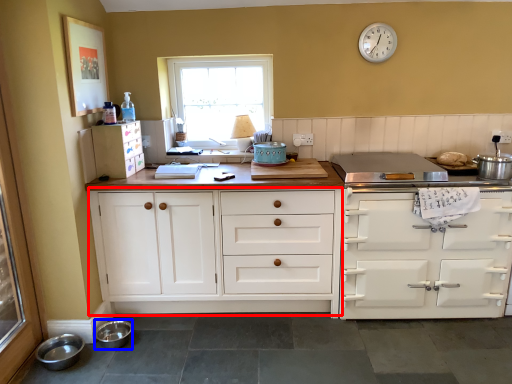
Question: Which point is closer to the camera, cabinetry (highlighted by a red box) or bowl (highlighted by a blue box)?

Choices:
 (A) cabinetry
 (B) bowl

Answer: (B)